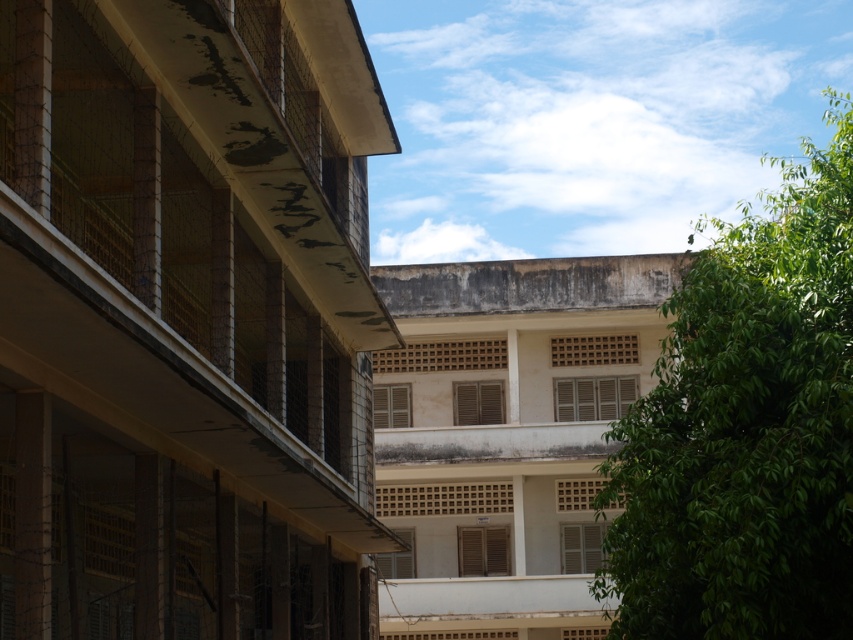
You are a window cleaner standing on the ground floor of the building. You need to clean the concrete textured balcony at left and the green leafy tree at upper right. Which object is closer to the ground?

The concrete textured balcony at left is closer to the ground since it has a lesser height compared to the green leafy tree at upper right.

You are a maintenance worker inspecting the building from the ground. You need to locate the concrete textured balcony at left for repairs. According to the coordinates provided, where exactly should you look on the building?

The concrete textured balcony at left is located at coordinates point (186,289).

You are an architect evaluating the building for renovation. You notice the concrete textured balcony at left and the green leafy tree at upper right. Which of these two features takes up more area on the building facade?

The green leafy tree at upper right takes up more area on the building facade than the concrete textured balcony at left.